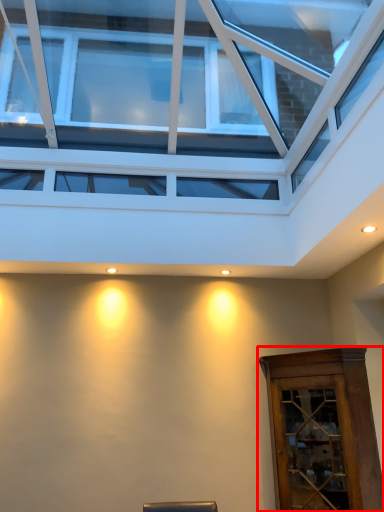
Question: From the image's perspective, what is the correct spatial relationship of elevator (annotated by the red box) in relation to window?

Choices:
 (A) below
 (B) above

Answer: (A)